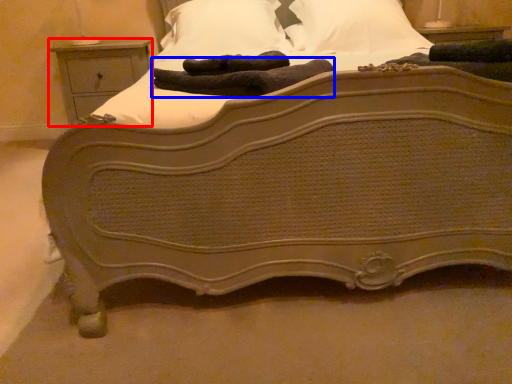
Question: Which object is closer to the camera taking this photo, nightstand (highlighted by a red box) or material (highlighted by a blue box)?

Choices:
 (A) nightstand
 (B) material

Answer: (B)